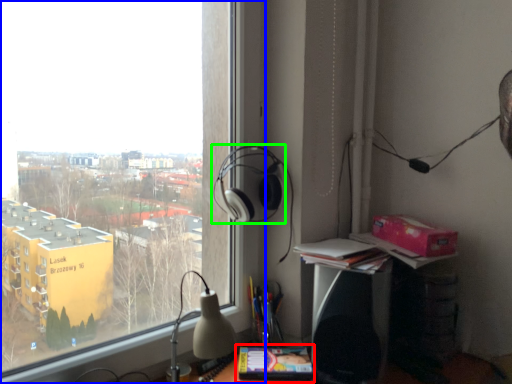
Question: Which is farther away from paperback book (highlighted by a red box)? window (highlighted by a blue box) or headphones (highlighted by a green box)?

Choices:
 (A) window
 (B) headphones

Answer: (A)